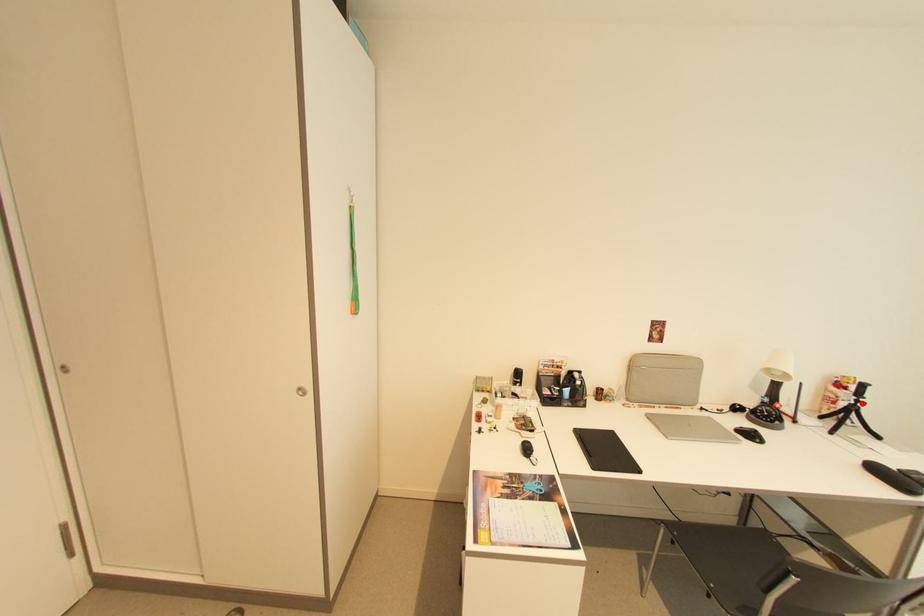
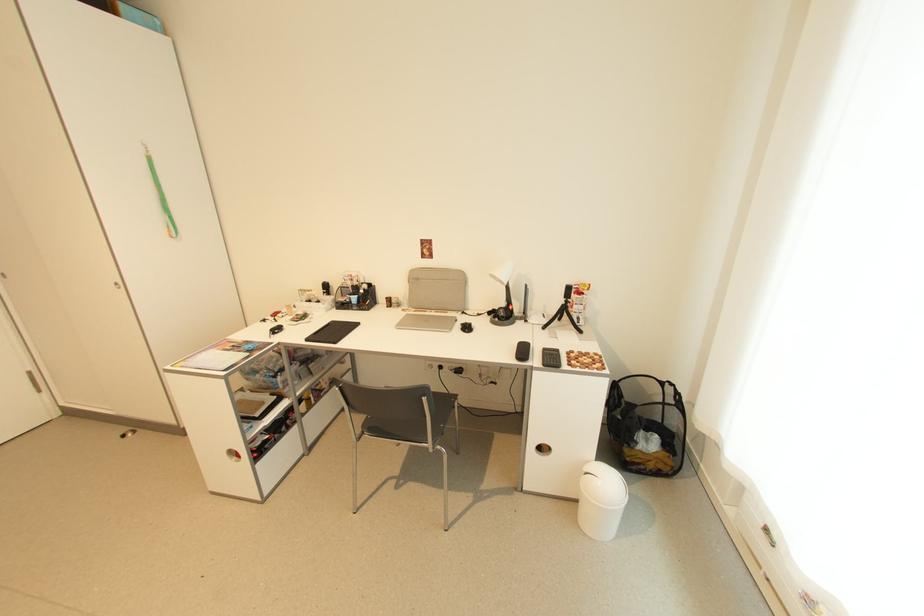
Question: I am providing you with two images of the same scene from different viewpoints. Image1 has a red point marked. In image2, the corresponding 3D location appears at what relative position? Reply with the corresponding letter.

Choices:
 (A) Closer
 (B) Farther

Answer: (B)